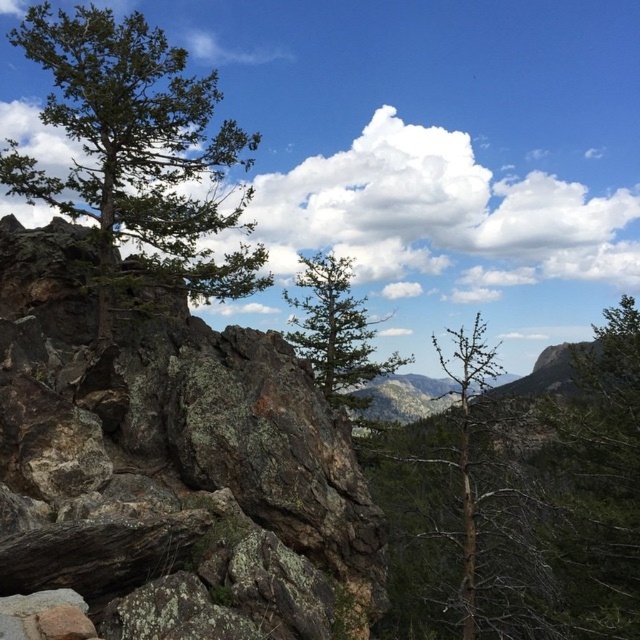
Question: Among these objects, which one is nearest to the camera?

Choices:
 (A) green matte tree at center
 (B) bare branches at center
 (C) green rough bark tree at left
 (D) green rough bark tree at center

Answer: (B)

Question: Based on their relative distances, which object is nearer to the bare branches at center?

Choices:
 (A) green rough bark tree at left
 (B) green rough bark tree at center
 (C) rusty brown rock at left
 (D) green matte tree at center

Answer: (D)

Question: Which point is closer to the camera?

Choices:
 (A) (451, 525)
 (B) (618, 595)
 (C) (381, 364)
 (D) (93, 70)

Answer: (D)

Question: Does green rough bark tree at center have a smaller size compared to green matte tree at center?

Choices:
 (A) yes
 (B) no

Answer: (B)

Question: Is the position of rusty brown rock at left less distant than that of green matte tree at center?

Choices:
 (A) yes
 (B) no

Answer: (A)

Question: Does bare branches at center have a lesser width compared to green matte tree at center?

Choices:
 (A) yes
 (B) no

Answer: (B)